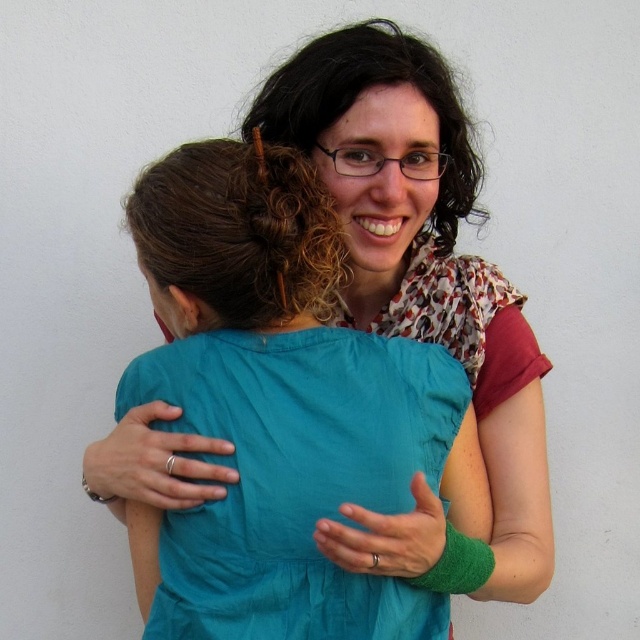
Measure the distance between matte teal dress at center and teal fabric dress at center.

matte teal dress at center and teal fabric dress at center are 5.24 inches apart from each other.

Who is more forward, (x=432, y=316) or (x=294, y=416)?

Point (x=294, y=416) is more forward.

Image resolution: width=640 pixels, height=640 pixels. Find the location of `matte teal dress at center`. matte teal dress at center is located at coordinates (420, 292).